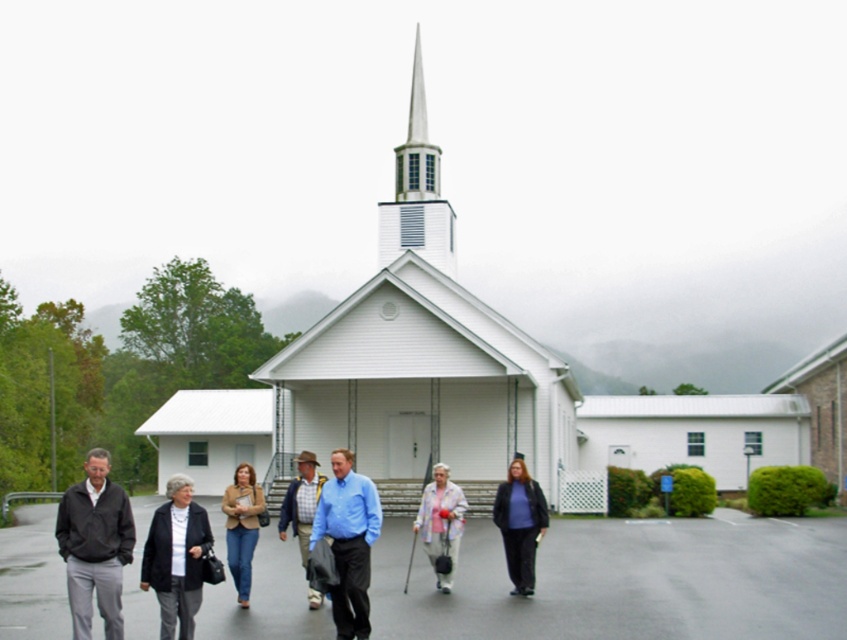
Question: Which object is positioned closest to the light gray fabric cane at center?

Choices:
 (A) tan leather jacket at center
 (B) white glossy steeple at upper center

Answer: (A)

Question: Does dark gray jacket at left have a lesser width compared to light gray fabric cane at center?

Choices:
 (A) yes
 (B) no

Answer: (B)

Question: Does white glossy steeple at upper center have a greater width compared to dark gray fabric jacket at lower left?

Choices:
 (A) yes
 (B) no

Answer: (A)

Question: Which object is farther from the camera taking this photo?

Choices:
 (A) plaid shirt at center
 (B) tan leather jacket at center
 (C) matte black jacket at center

Answer: (C)

Question: Does dark gray fabric jacket at lower left lie in front of light gray fabric cane at center?

Choices:
 (A) no
 (B) yes

Answer: (B)

Question: Which object is farther from the camera taking this photo?

Choices:
 (A) smooth asphalt pavement at center
 (B) dark gray jacket at left

Answer: (A)